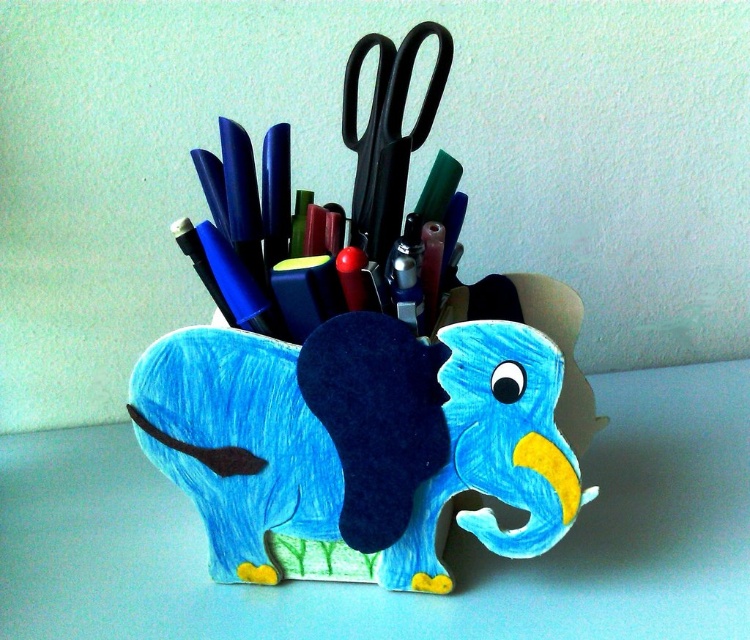
Question: Is blue felt elephant at center wider than black plastic scissors at center?

Choices:
 (A) yes
 (B) no

Answer: (A)

Question: Which object is farther from the camera taking this photo?

Choices:
 (A) blue felt elephant at center
 (B) black plastic scissors at center

Answer: (B)

Question: Is blue felt elephant at center below black plastic scissors at center?

Choices:
 (A) yes
 (B) no

Answer: (A)

Question: Is blue felt elephant at center thinner than black plastic scissors at center?

Choices:
 (A) yes
 (B) no

Answer: (B)

Question: Which of the following is the farthest from the observer?

Choices:
 (A) black plastic scissors at center
 (B) blue felt elephant at center

Answer: (A)

Question: Which point is farther to the camera?

Choices:
 (A) (402, 548)
 (B) (375, 92)

Answer: (B)